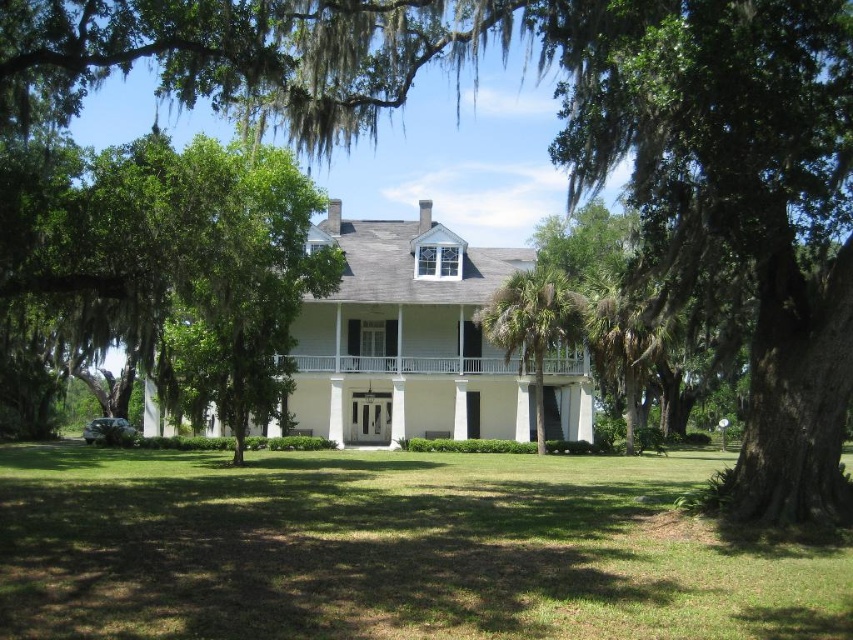
You are standing in front of the house and want to take a photo. You notice two points marked in the scene. Which point, point (521, 586) or point (556, 362), is closer to your current position?

Point (521, 586) is closer to the camera than point (556, 362), so it is closer to your current position.

You are a gardener who needs to mow the lawn. You see the green grass at center and the white wooden porch at center. Which area requires immediate attention based on their current states?

The green grass at center requires immediate attention because it is much taller than the white wooden porch at center, indicating it has grown significantly and needs mowing.

You are planning to host a garden party and want to place a large tent on the lawn. The tent requires an open space larger than the size of the white wooden porch at center. Can the green leafy palm tree at center provide enough space for the tent?

The green leafy palm tree at center is bigger than the white wooden porch at center, so the space around it is sufficient to accommodate the tent.